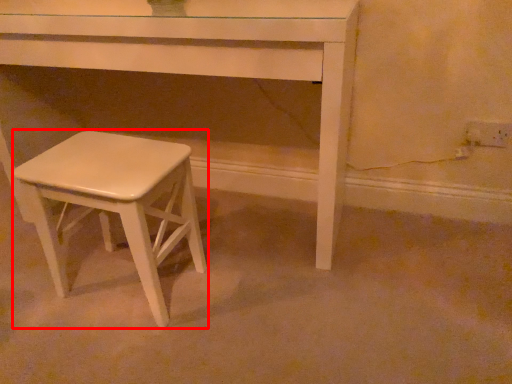
Question: Considering the relative positions of stool (annotated by the red box) and table in the image provided, where is stool (annotated by the red box) located with respect to the staircase?

Choices:
 (A) right
 (B) left

Answer: (B)